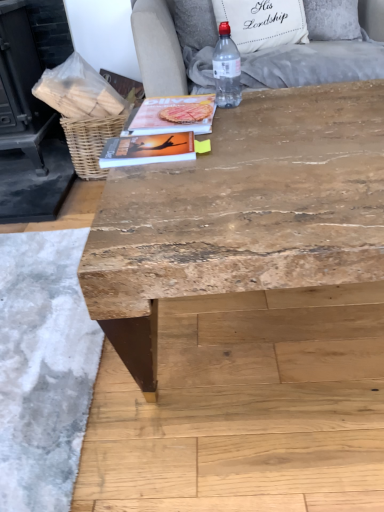
Identify the location of vacant area located to the right-hand side of matte paper magazine at center, placed as the second magazine when sorted from bottom to top. Image resolution: width=384 pixels, height=512 pixels. 269,112.